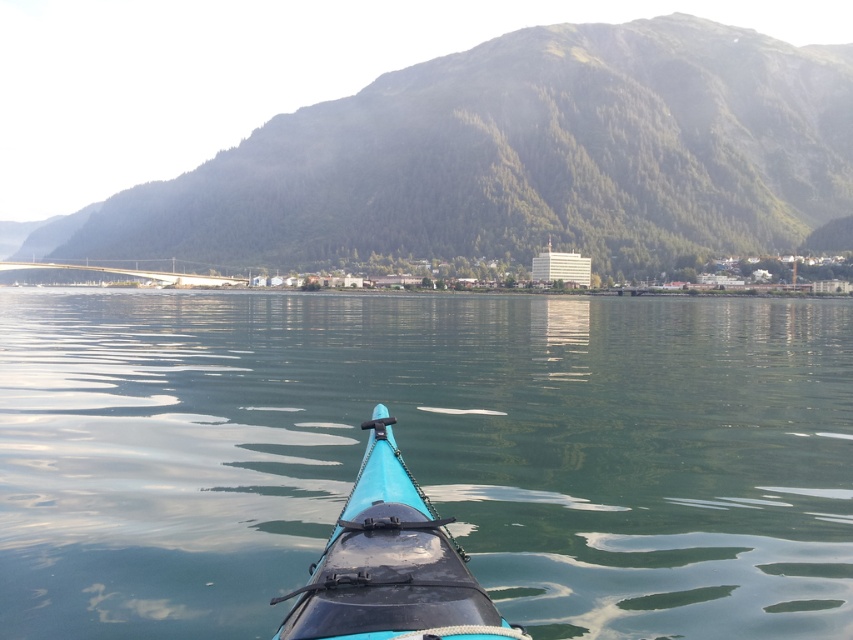
You are kayaking and want to know if the green smooth water at center is larger or smaller in size compared to the green forested mountain at upper center. Based on the scene, what can you observe?

The green smooth water at center is smaller than the green forested mountain at upper center according to the description.

You are in a kayak and want to know if the green forested mountain at upper center is taller than the teal matte kayak at center. Can you confirm this based on the scene?

The green forested mountain at upper center has a greater height compared to the teal matte kayak at center, so yes, the green forested mountain at upper center is taller than the teal matte kayak at center.

You are kayaking and looking at the green smooth water at center and the green forested mountain at upper center. Which one appears taller in the scene?

The green forested mountain at upper center appears taller than the green smooth water at center in the scene.